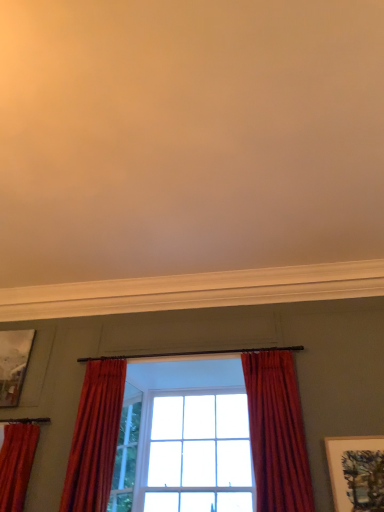
Question: Which direction should I rotate to look at satin red curtain at center, which is the second curtain from left to right?

Choices:
 (A) right
 (B) left

Answer: (B)

Question: From the image's perspective, is velvet red curtain at center, which ranks as the 1th curtain in right-to-left order, under velvet red curtain at left, placed as the 3th curtain when sorted from right to left?

Choices:
 (A) yes
 (B) no

Answer: (B)

Question: Is velvet red curtain at center, arranged as the third curtain when viewed from the left, positioned behind velvet red curtain at left, the first curtain from the left?

Choices:
 (A) yes
 (B) no

Answer: (B)

Question: Does velvet red curtain at center, which ranks as the 1th curtain in right-to-left order, come in front of velvet red curtain at left, the first curtain from the left?

Choices:
 (A) yes
 (B) no

Answer: (A)

Question: Would you say velvet red curtain at center, arranged as the third curtain when viewed from the left, contains velvet red curtain at left, placed as the 3th curtain when sorted from right to left?

Choices:
 (A) no
 (B) yes

Answer: (A)

Question: Considering the relative sizes of velvet red curtain at center, arranged as the third curtain when viewed from the left, and velvet red curtain at left, placed as the 3th curtain when sorted from right to left, in the image provided, is velvet red curtain at center, arranged as the third curtain when viewed from the left, shorter than velvet red curtain at left, placed as the 3th curtain when sorted from right to left,?

Choices:
 (A) yes
 (B) no

Answer: (B)

Question: Is velvet red curtain at center, which ranks as the 1th curtain in right-to-left order, oriented towards velvet red curtain at left, placed as the 3th curtain when sorted from right to left?

Choices:
 (A) yes
 (B) no

Answer: (B)

Question: Considering the relative positions of clear glass window at center and metallic silver picture frame at upper left, arranged as the 2th picture frame when ordered from the bottom, in the image provided, is clear glass window at center to the left of metallic silver picture frame at upper left, arranged as the 2th picture frame when ordered from the bottom, from the viewer's perspective?

Choices:
 (A) yes
 (B) no

Answer: (B)

Question: From the image's perspective, would you say clear glass window at center is positioned over metallic silver picture frame at upper left, the 1th picture frame positioned from the left?

Choices:
 (A) no
 (B) yes

Answer: (A)

Question: From a real-world perspective, is clear glass window at center physically below metallic silver picture frame at upper left, the 1th picture frame positioned from the left?

Choices:
 (A) no
 (B) yes

Answer: (B)

Question: Is clear glass window at center bigger than metallic silver picture frame at upper left, arranged as the 2th picture frame when ordered from the bottom?

Choices:
 (A) no
 (B) yes

Answer: (B)

Question: Is clear glass window at center smaller than metallic silver picture frame at upper left, the 2th picture frame from the right?

Choices:
 (A) no
 (B) yes

Answer: (A)

Question: Is clear glass window at center far away from metallic silver picture frame at upper left, the 1th picture frame positioned from the top?

Choices:
 (A) yes
 (B) no

Answer: (A)

Question: Would you say velvet red curtain at center, arranged as the third curtain when viewed from the left, is outside satin red curtain at center, positioned as the second curtain in right-to-left order?

Choices:
 (A) no
 (B) yes

Answer: (B)